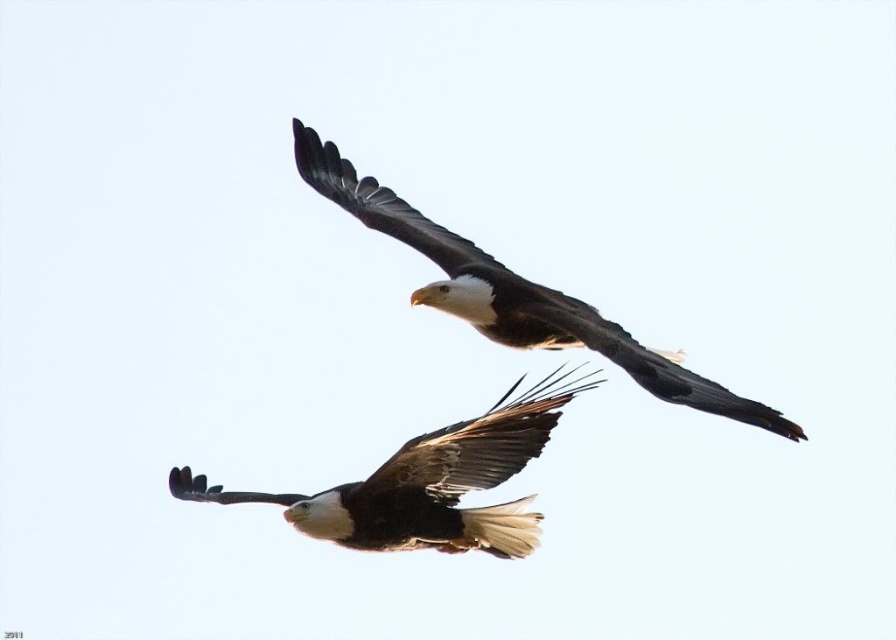
Which of these two, white-brown feathers eagle at lower center or brown feathered wing at center, stands taller?

With more height is white-brown feathers eagle at lower center.

Does white-brown feathers eagle at lower center have a smaller size compared to brown feathered wing at center?

Actually, white-brown feathers eagle at lower center might be larger than brown feathered wing at center.

Between point (453, 444) and point (427, 433), which one is positioned in front?

Point (453, 444)

Where is `white-brown feathers eagle at lower center`? white-brown feathers eagle at lower center is located at coordinates (426, 484).

Is white-feathered bald eagle at upper center thinner than white feathered wing at upper center?

No, white-feathered bald eagle at upper center is not thinner than white feathered wing at upper center.

Does white-feathered bald eagle at upper center have a smaller size compared to white feathered wing at upper center?

No.

You are a GUI agent. You are given a task and a screenshot of the screen. Output one action in this format:
    pyautogui.click(x=<x>, y=<y>)
    Task: Click on the white-feathered bald eagle at upper center
    
    Given the screenshot: What is the action you would take?
    pyautogui.click(x=514, y=292)

The image size is (896, 640). What do you see at coordinates (426, 484) in the screenshot? I see `white-brown feathers eagle at lower center` at bounding box center [426, 484].

Between point (302, 529) and point (325, 144), which one is positioned in front?

Positioned in front is point (302, 529).

Find the location of `white-brown feathers eagle at lower center`. white-brown feathers eagle at lower center is located at coordinates (426, 484).